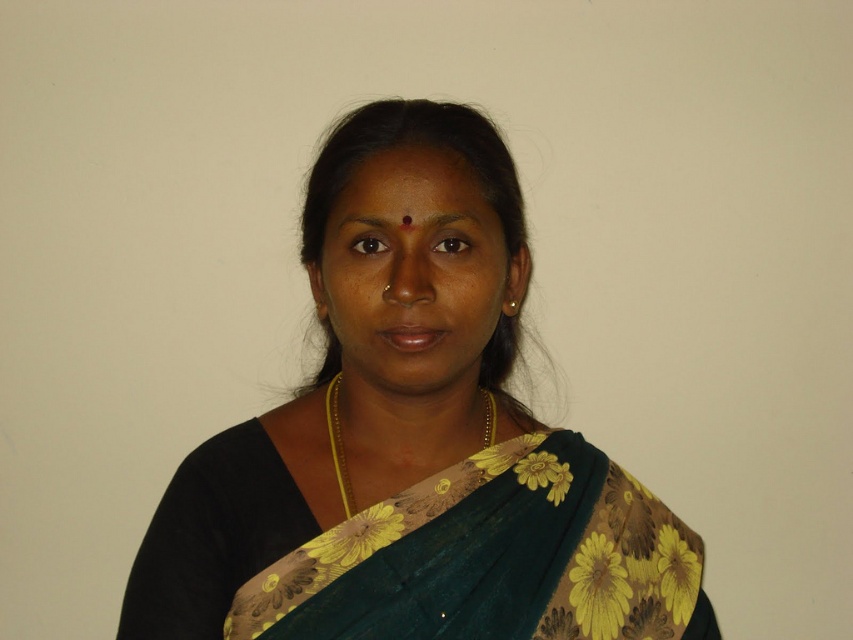
Based on the photo, how much distance is there between green floral saree at center and matte green saree at center?

2.52 inches

Is green floral saree at center in front of matte green saree at center?

No, it is behind matte green saree at center.

Does point (664, 509) come farther from viewer compared to point (395, 305)?

Yes, point (664, 509) is behind point (395, 305).

Find the location of `green floral saree at center`. green floral saree at center is located at coordinates (412, 440).

Which is more to the left, green floral saree at center or gold chain at center?

green floral saree at center

Does green floral saree at center appear on the right side of gold chain at center?

No, green floral saree at center is not to the right of gold chain at center.

Describe the element at coordinates (412, 440) in the screenshot. The width and height of the screenshot is (853, 640). I see `green floral saree at center` at that location.

Locate an element on the screen. green floral saree at center is located at coordinates (412, 440).

This screenshot has height=640, width=853. Describe the element at coordinates (416, 275) in the screenshot. I see `matte green saree at center` at that location.

Does matte green saree at center appear under gold chain at center?

Incorrect, matte green saree at center is not positioned below gold chain at center.

Is point (421, 195) positioned in front of point (339, 451)?

Yes.

I want to click on matte green saree at center, so click(x=416, y=275).